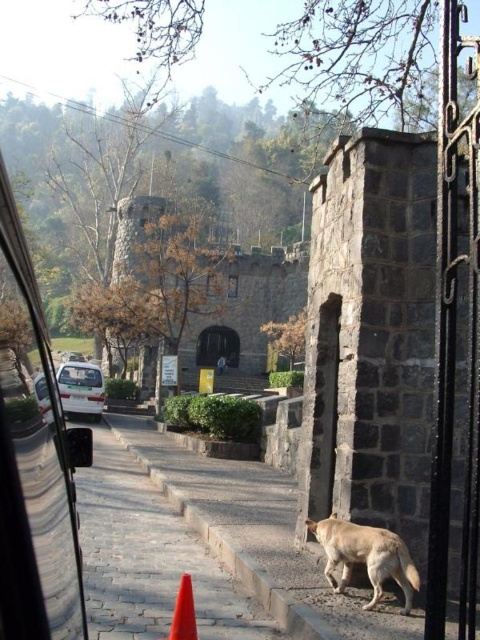
Question: Which is nearer to the fuzzy beige dog at lower right?

Choices:
 (A) paved stone pavement at center
 (B) transparent glass car window at left
 (C) orange rubber traffic cone at lower center

Answer: (C)

Question: Does transparent glass car window at left lie behind orange rubber traffic cone at lower center?

Choices:
 (A) no
 (B) yes

Answer: (A)

Question: Which is nearer to the fuzzy beige dog at lower right?

Choices:
 (A) transparent glass car window at left
 (B) white matte van at left
 (C) orange rubber traffic cone at lower center
 (D) paved stone pavement at center

Answer: (C)

Question: Does paved stone pavement at center have a smaller size compared to orange rubber traffic cone at lower center?

Choices:
 (A) yes
 (B) no

Answer: (B)

Question: Does paved stone pavement at center have a lesser width compared to white matte van at left?

Choices:
 (A) no
 (B) yes

Answer: (A)

Question: Which of the following is the farthest from the observer?

Choices:
 (A) (81, 380)
 (B) (12, 284)
 (C) (180, 611)

Answer: (A)